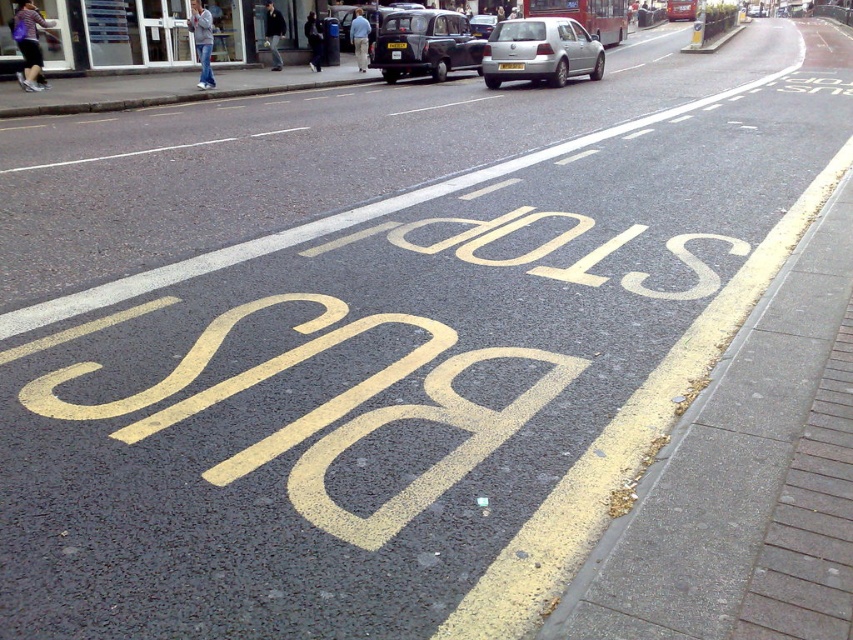
You are a delivery driver who needs to park your vehicle, which is 2 meters wide, at the bus stop area shown in the image. Based on the gray concrete curb at upper center and the black matte taxi at center, can you determine if there is enough space to park your vehicle without overlapping the curb?

The gray concrete curb at upper center might be wider than the black matte taxi at center, but since the exact width of the curb is not specified, it is uncertain whether there is enough space to park the 2 meter wide vehicle without overlapping the curb. Further measurement would be needed.

You are a delivery driver who needs to park your van at the bus stop marked with large yellow letters. The van is 6 meters long. The bus stop area is defined by the gray concrete curb at upper center. Can you fit your van entirely within the bus stop area?

The position of gray concrete curb at upper center is at point (x=165, y=90). Without knowing the dimensions of the bus stop area, it is impossible to determine if the van will fit.